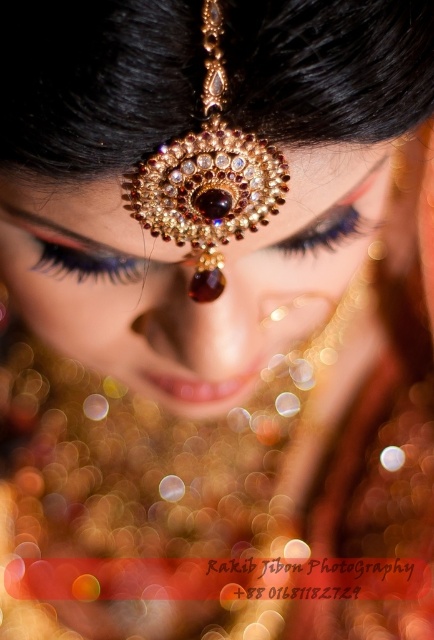
Consider the image. You are a photographer adjusting your camera settings to capture the maang tikka in the image. The camera lens has a focal length of 50mm. If you want to ensure the point at coordinate point (68, 268) is in focus, what is the minimum distance you should maintain from the subject?

The minimum distance you should maintain from the subject is 22.89 inches to ensure the point at coordinate point (68, 268) is in focus.

You are a makeup artist preparing for a bridal photoshoot. You notice the black matte eyelashes at upper left and the blue eyelashes at center in the image. Which eyelash set is placed closer to the forehead?

The black matte eyelashes at upper left is positioned under the blue eyelashes at center, meaning it is closer to the forehead.

You are a photographer adjusting lighting for a portrait. The subject has gold textured jewelry at center and black matte eyelashes at upper left. To ensure both elements are equally highlighted, where should you place the light source relative to the subject?

The gold textured jewelry at center is positioned on the right side of black matte eyelashes at upper left. To equally highlight both elements, place the light source to the left of the subject so that it illuminates both the jewelry and eyelashes simultaneously.